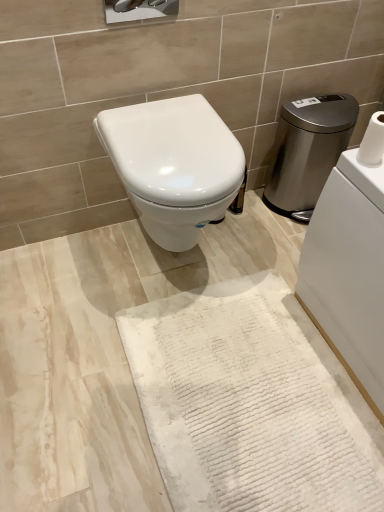
The height and width of the screenshot is (512, 384). Describe the element at coordinates (308, 151) in the screenshot. I see `stainless steel water heater at right` at that location.

Identify the location of stainless steel water heater at right. (308, 151).

Would you say white glossy toilet at center is to the left or to the right of stainless steel water heater at right in the picture?

In the image, white glossy toilet at center appears on the left side of stainless steel water heater at right.

From the image's perspective, is white glossy toilet at center positioned above or below stainless steel water heater at right?

white glossy toilet at center is below stainless steel water heater at right.

Could you tell me if white glossy toilet at center is facing stainless steel water heater at right?

No.

From a real-world perspective, who is located lower, white glossy toilet at center or stainless steel water heater at right?

stainless steel water heater at right is physically lower.

Between white textured toilet paper at upper right and white textured bath mat at center, which one appears on the left side from the viewer's perspective?

white textured bath mat at center is more to the left.

Can you confirm if white textured toilet paper at upper right is smaller than white textured bath mat at center?

Yes.

What's the angular difference between white textured toilet paper at upper right and white textured bath mat at center's facing directions?

white textured toilet paper at upper right and white textured bath mat at center are facing 0.348 degrees away from each other.

Considering their positions, is white textured toilet paper at upper right located in front of or behind white textured bath mat at center?

white textured toilet paper at upper right is positioned farther from the viewer than white textured bath mat at center.

Between white glossy toilet at center and white textured bath mat at center, which one is positioned behind?

white glossy toilet at center is further away from the camera.

In the scene shown: Which of these two, white glossy toilet at center or white textured bath mat at center, is thinner?

Thinner between the two is white glossy toilet at center.

Visually, is white glossy toilet at center positioned to the left or to the right of white textured bath mat at center?

In the image, white glossy toilet at center appears on the left side of white textured bath mat at center.

From the image's perspective, which is above, white textured bath mat at center or stainless steel water heater at right?

stainless steel water heater at right is shown above in the image.

Does point (195, 466) come behind point (322, 181)?

No, it is not.

What's the angular difference between white textured bath mat at center and stainless steel water heater at right's facing directions?

The facing directions of white textured bath mat at center and stainless steel water heater at right are 90.2 degrees apart.

From a real-world perspective, does white textured bath mat at center sit lower than stainless steel water heater at right?

Correct, in the physical world, white textured bath mat at center is lower than stainless steel water heater at right.

From a real-world perspective, between white textured toilet paper at upper right and stainless steel water heater at right, who is vertically higher?

white textured toilet paper at upper right is physically above.

Does point (368, 139) come behind point (340, 119)?

No, (368, 139) is closer to viewer.

Who is smaller, white textured toilet paper at upper right or stainless steel water heater at right?

white textured toilet paper at upper right.

Is white textured toilet paper at upper right positioned with its back to white glossy toilet at center?

white textured toilet paper at upper right is not turned away from white glossy toilet at center.

Is white textured toilet paper at upper right further to the viewer compared to white glossy toilet at center?

No.

Are white textured toilet paper at upper right and white glossy toilet at center far apart?

No, white textured toilet paper at upper right is in close proximity to white glossy toilet at center.

From a real-world perspective, does white textured toilet paper at upper right stand above white glossy toilet at center?

Indeed, from a real-world perspective, white textured toilet paper at upper right stands above white glossy toilet at center.

Between stainless steel water heater at right and white glossy toilet at center, which one appears on the right side from the viewer's perspective?

Positioned to the right is stainless steel water heater at right.

From a real-world perspective, is stainless steel water heater at right positioned under white glossy toilet at center based on gravity?

Yes.

Who is bigger, stainless steel water heater at right or white glossy toilet at center?

white glossy toilet at center is bigger.

Could you tell me if stainless steel water heater at right is facing white glossy toilet at center?

No.

Find the location of a particular element. This screenshot has height=512, width=384. toilet that is above the stainless steel water heater at right (from a real-world perspective) is located at coordinates (173, 164).

You are a GUI agent. You are given a task and a screenshot of the screen. Output one action in this format:
    pyautogui.click(x=<x>, y=<y>)
    Task: Click on the bath mat below the white textured toilet paper at upper right (from a real-world perspective)
    
    Given the screenshot: What is the action you would take?
    pyautogui.click(x=250, y=403)

Which object lies further to the anchor point white textured toilet paper at upper right, white textured bath mat at center or white glossy toilet at center?

white textured bath mat at center lies further to white textured toilet paper at upper right than the other object.

Which object lies nearer to the anchor point white textured bath mat at center, white textured toilet paper at upper right or white glossy toilet at center?

The object closer to white textured bath mat at center is white glossy toilet at center.

Which object lies nearer to the anchor point white glossy toilet at center, stainless steel water heater at right or white textured bath mat at center?

white textured bath mat at center lies closer to white glossy toilet at center than the other object.

Which object lies further to the anchor point white textured bath mat at center, stainless steel water heater at right or white textured toilet paper at upper right?

Based on the image, stainless steel water heater at right appears to be further to white textured bath mat at center.

From the image, which object appears to be nearer to white textured toilet paper at upper right, stainless steel water heater at right or white textured bath mat at center?

Among the two, stainless steel water heater at right is located nearer to white textured toilet paper at upper right.

Looking at the image, which one is located closer to white textured toilet paper at upper right, white textured bath mat at center or stainless steel water heater at right?

stainless steel water heater at right is positioned closer to the anchor white textured toilet paper at upper right.

When comparing their distances from white textured toilet paper at upper right, does stainless steel water heater at right or white glossy toilet at center seem further?

stainless steel water heater at right is further to white textured toilet paper at upper right.

Looking at the image, which one is located further to stainless steel water heater at right, white textured toilet paper at upper right or white glossy toilet at center?

white textured toilet paper at upper right is positioned further to the anchor stainless steel water heater at right.

This screenshot has width=384, height=512. I want to click on toilet between white textured toilet paper at upper right and white textured bath mat at center in the up-down direction, so click(x=173, y=164).

I want to click on toilet paper that lies between stainless steel water heater at right and white textured bath mat at center from top to bottom, so click(x=372, y=142).

The width and height of the screenshot is (384, 512). Identify the location of toilet between stainless steel water heater at right and white textured bath mat at center in the up-down direction. (173, 164).

I want to click on toilet paper between white glossy toilet at center and stainless steel water heater at right from left to right, so click(372, 142).